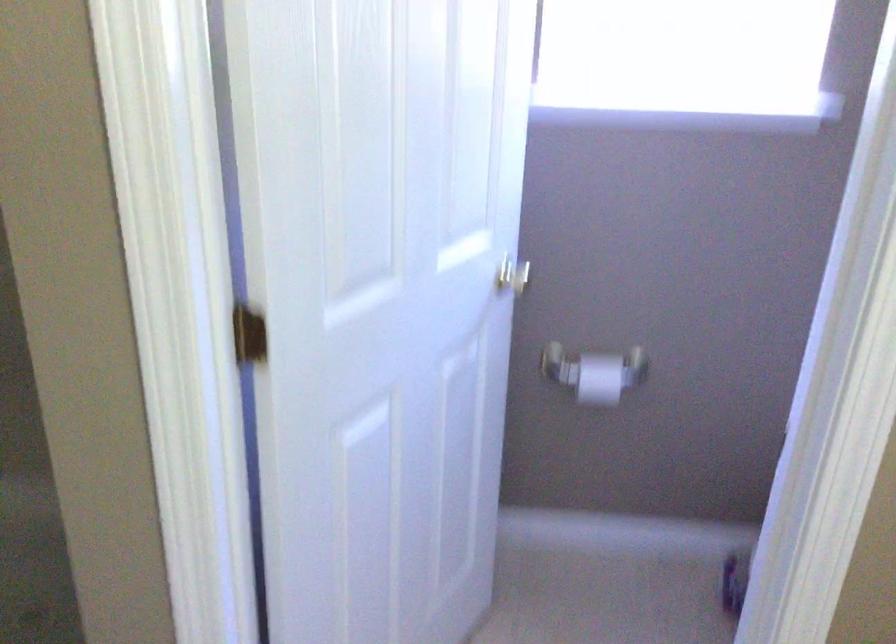
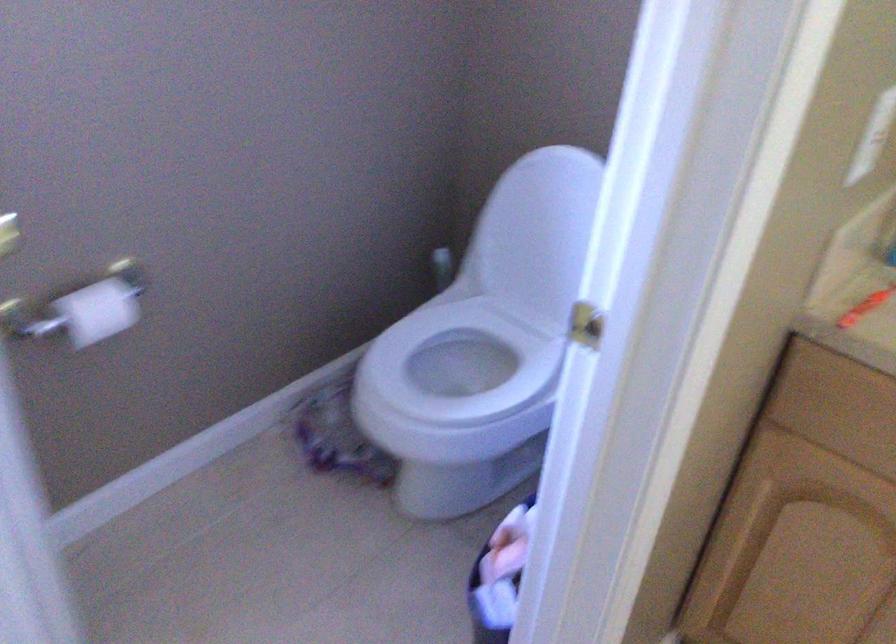
In the second image, find the point that corresponds to pixel 593 377 in the first image.

(97, 310)